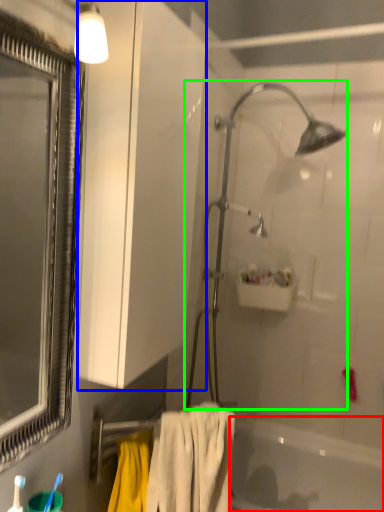
Question: Which object is the closest to the bathtub (highlighted by a red box)? Choose among these: screen door (highlighted by a blue box) or shower (highlighted by a green box).

Choices:
 (A) screen door
 (B) shower

Answer: (B)